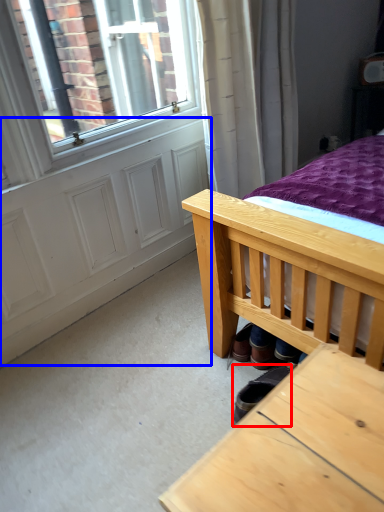
Question: Which of the following is the farthest to the observer, footwear (highlighted by a red box) or screen door (highlighted by a blue box)?

Choices:
 (A) footwear
 (B) screen door

Answer: (B)